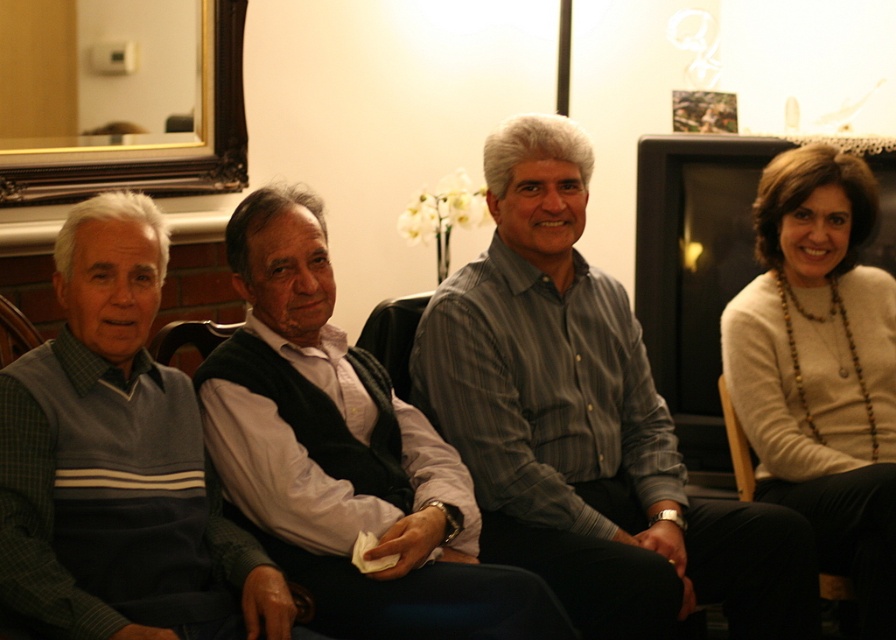
You are organizing a small event and need to determine seating arrangements. You have a green sweater at left and a wooden chair at left in the room. Which item takes up more space?

The green sweater at left is larger in size than the wooden chair at left, so it takes up more space.

You are a delivery person trying to place a small package between the green sweater at left and the wooden chair at left. Can you fit the package there?

The distance between the green sweater at left and the wooden chair at left is 25.55 inches, so the package can be placed there as the space is sufficient.